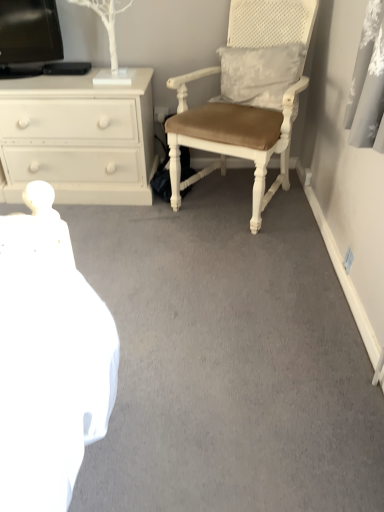
You are a GUI agent. You are given a task and a screenshot of the screen. Output one action in this format:
    pyautogui.click(x=<x>, y=<y>)
    Task: Click on the free spot below white wood chair at right (from a real-world perspective)
    The width and height of the screenshot is (384, 512).
    Given the screenshot: What is the action you would take?
    pyautogui.click(x=231, y=200)